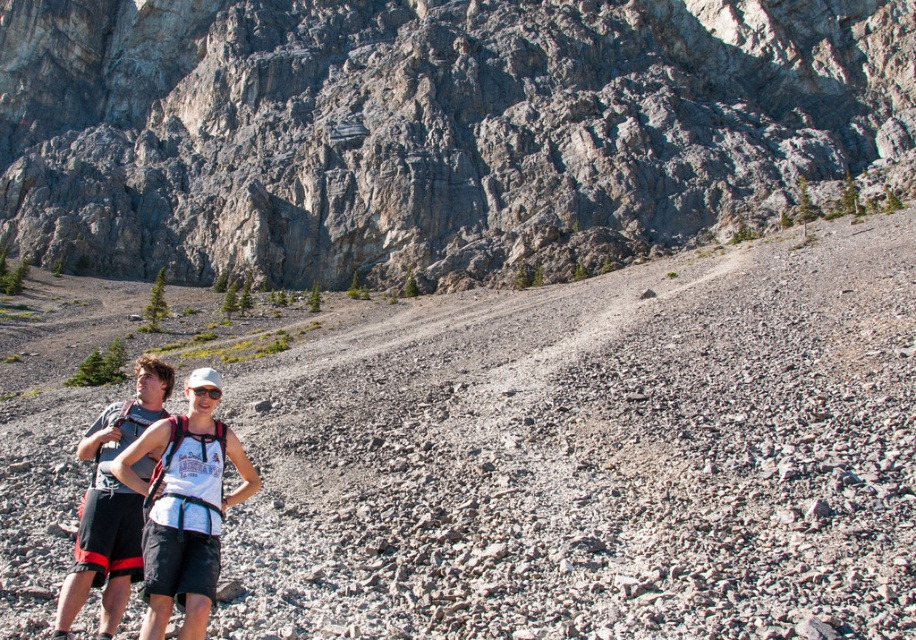
You are a photographer trying to capture the entire gray rocky mountain at upper center and the white mesh tank top at center in a single shot. Based on their sizes in the image, do you think both will fit within the frame?

The gray rocky mountain at upper center might be wider than the white mesh tank top at center, so it is possible that the mountain could occupy more of the frame, but both should still fit as long as the camera angle is adjusted appropriately.